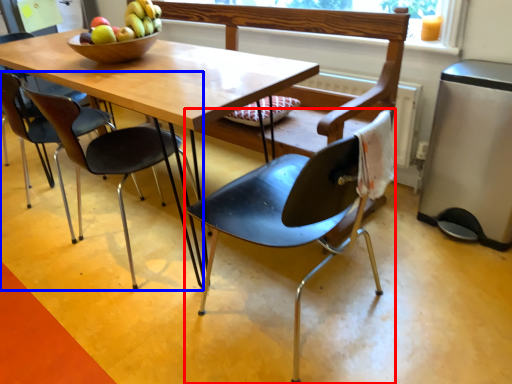
Question: Which object appears farthest to the camera in this image, chair (highlighted by a red box) or chair (highlighted by a blue box)?

Choices:
 (A) chair
 (B) chair

Answer: (B)